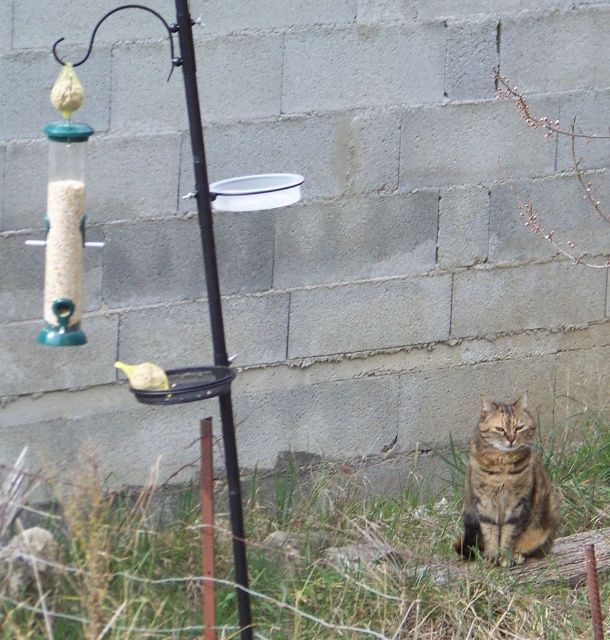
You are standing in front of the bird feeder and want to know the exact location of the black metal pole at center. What are its coordinates?

The black metal pole at center is located at coordinates point (201, 180).

Based on the photo, you are standing in the garden and see the black metal pole at center and the yellow matte bird at left. Which object is closer to the right side of the image?

The black metal pole at center is closer to the right side of the image because it is positioned to the right of the yellow matte bird at left.

You are a gardener who needs to place a 3.5 feet wide decorative stone planter between the green grass at lower right and the black metal pole at center. Will there be enough space to fit it without moving either object?

The distance between the green grass at lower right and the black metal pole at center is 4.56 feet. Since the planter is 3.5 feet wide, there is enough space to place it between them as 3.5 feet is less than 4.56 feet.